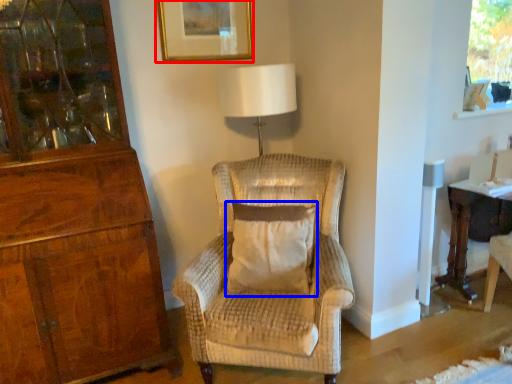
Question: Which object appears closest to the camera in this image, picture frame (highlighted by a red box) or pillow (highlighted by a blue box)?

Choices:
 (A) picture frame
 (B) pillow

Answer: (B)